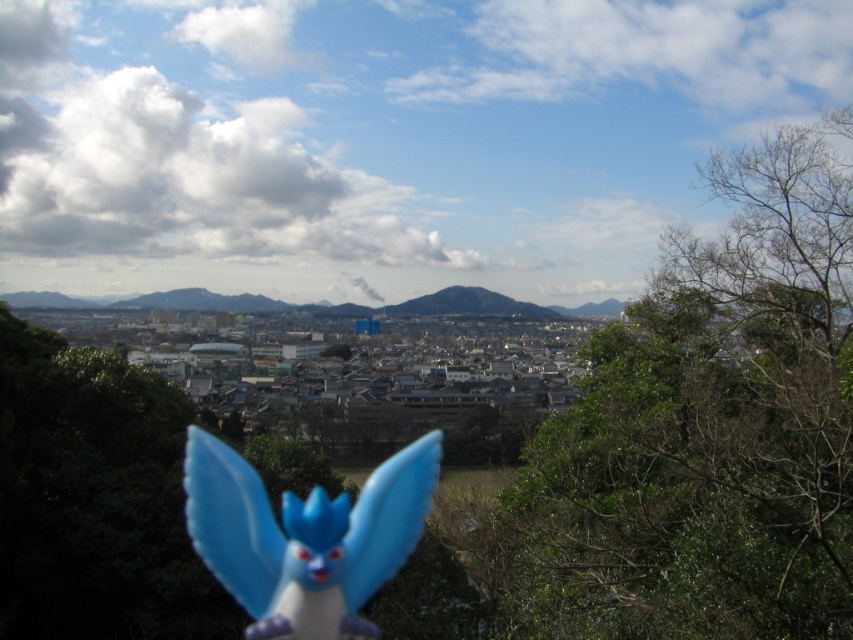
Question: Is green leafy tree at center right above blue plastic toy at center?

Choices:
 (A) yes
 (B) no

Answer: (A)

Question: Is green leafy tree at center right positioned behind blue plastic toy at center?

Choices:
 (A) no
 (B) yes

Answer: (A)

Question: Which point is farther to the camera?

Choices:
 (A) (811, 404)
 (B) (326, 554)

Answer: (B)

Question: Is green leafy tree at center right positioned at the back of blue plastic toy at center?

Choices:
 (A) yes
 (B) no

Answer: (B)